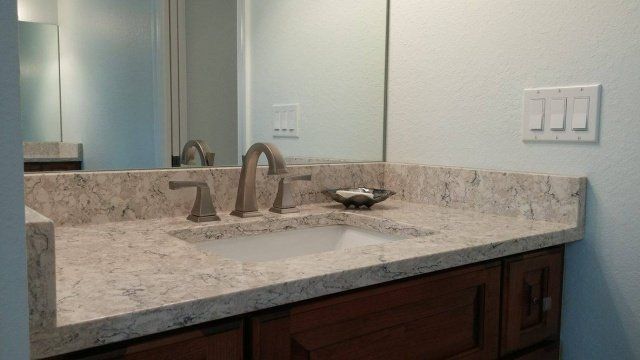
The height and width of the screenshot is (360, 640). What are the coordinates of `screws` in the screenshot? It's located at (536, 91), (536, 136), (555, 138), (560, 89), (582, 88), (579, 138).